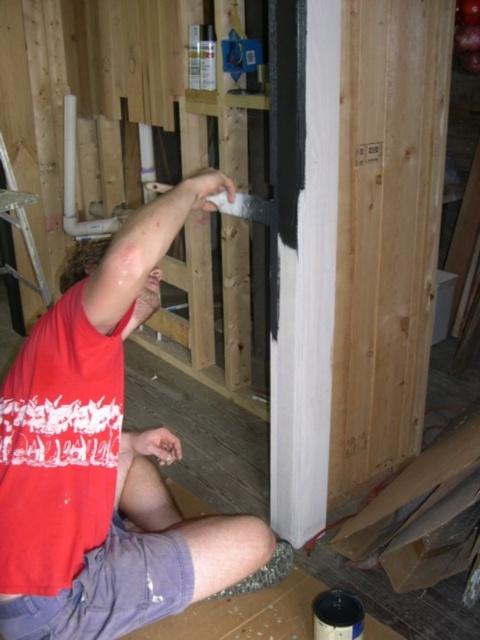
Question: Is matte red t-shirt at upper left behind silver metallic ladder at left?

Choices:
 (A) yes
 (B) no

Answer: (B)

Question: Does matte red t-shirt at upper left appear on the left side of silver metallic ladder at left?

Choices:
 (A) no
 (B) yes

Answer: (A)

Question: Does matte red t-shirt at upper left appear under silver metallic ladder at left?

Choices:
 (A) yes
 (B) no

Answer: (A)

Question: Which of the following is the closest to the observer?

Choices:
 (A) silver metallic ladder at left
 (B) matte red t-shirt at upper left

Answer: (B)

Question: Which point is closer to the camera?

Choices:
 (A) (6, 205)
 (B) (62, 557)

Answer: (B)

Question: Which object appears farthest from the camera in this image?

Choices:
 (A) matte red t-shirt at upper left
 (B) silver metallic ladder at left

Answer: (B)